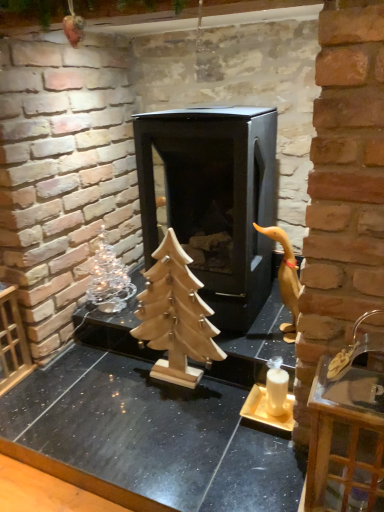
Question: Is wooden christmas tree at center taller than clear glass tray at right?

Choices:
 (A) no
 (B) yes

Answer: (B)

Question: Can you confirm if wooden christmas tree at center is positioned to the left of clear glass tray at right?

Choices:
 (A) no
 (B) yes

Answer: (B)

Question: Is wooden christmas tree at center not within clear glass tray at right?

Choices:
 (A) yes
 (B) no

Answer: (A)

Question: Is wooden christmas tree at center beside clear glass tray at right?

Choices:
 (A) no
 (B) yes

Answer: (A)

Question: From a real-world perspective, is wooden christmas tree at center positioned over clear glass tray at right based on gravity?

Choices:
 (A) yes
 (B) no

Answer: (A)

Question: Does wooden christmas tree at center have a smaller size compared to clear glass tray at right?

Choices:
 (A) yes
 (B) no

Answer: (A)

Question: Is the position of silver metallic christmas tree at left less distant than that of black matte fireplace at center?

Choices:
 (A) yes
 (B) no

Answer: (B)

Question: From a real-world perspective, is silver metallic christmas tree at left physically above black matte fireplace at center?

Choices:
 (A) no
 (B) yes

Answer: (A)

Question: Considering the relative sizes of silver metallic christmas tree at left and black matte fireplace at center in the image provided, is silver metallic christmas tree at left bigger than black matte fireplace at center?

Choices:
 (A) no
 (B) yes

Answer: (A)

Question: Does silver metallic christmas tree at left come behind black matte fireplace at center?

Choices:
 (A) no
 (B) yes

Answer: (B)

Question: Can you confirm if silver metallic christmas tree at left is taller than black matte fireplace at center?

Choices:
 (A) yes
 (B) no

Answer: (B)

Question: From a real-world perspective, is silver metallic christmas tree at left under black matte fireplace at center?

Choices:
 (A) no
 (B) yes

Answer: (B)

Question: Can you confirm if clear glass tray at right is bigger than black matte fireplace at center?

Choices:
 (A) yes
 (B) no

Answer: (B)